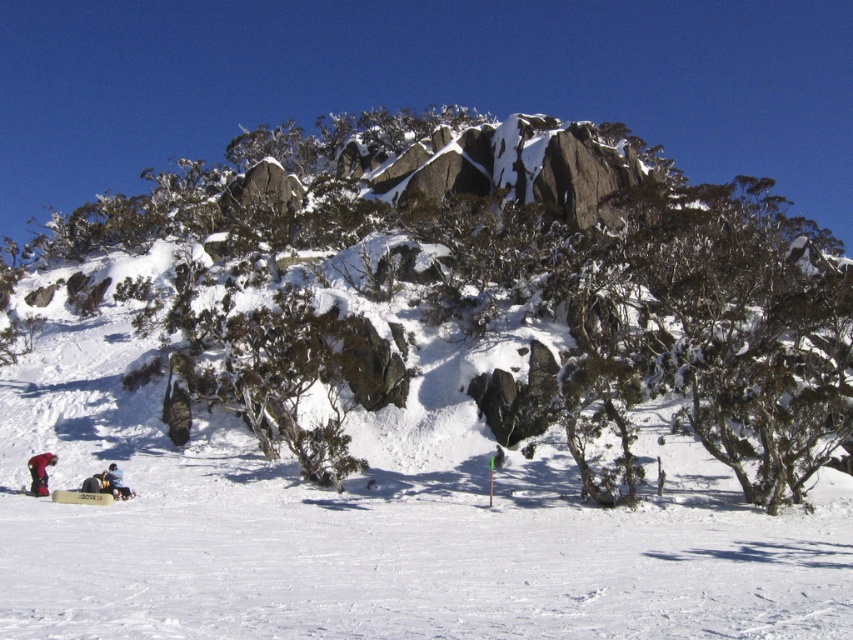
Question: Can you confirm if green leafy shrub at center is smaller than red fabric jacket at lower left?

Choices:
 (A) no
 (B) yes

Answer: (A)

Question: Is green leafy shrub at center to the right of red fabric jacket at lower left from the viewer's perspective?

Choices:
 (A) yes
 (B) no

Answer: (A)

Question: Which object appears farthest from the camera in this image?

Choices:
 (A) white snowboarder at lower left
 (B) green leafy shrub at center

Answer: (B)

Question: Does red fabric jacket at lower left have a greater width compared to white snowboarder at lower left?

Choices:
 (A) yes
 (B) no

Answer: (B)

Question: Which point is closer to the camera?

Choices:
 (A) red fabric jacket at lower left
 (B) green leafy shrub at center
 (C) white snowboarder at lower left

Answer: (C)

Question: Among these objects, which one is nearest to the camera?

Choices:
 (A) white snowboarder at lower left
 (B) red fabric jacket at lower left

Answer: (A)